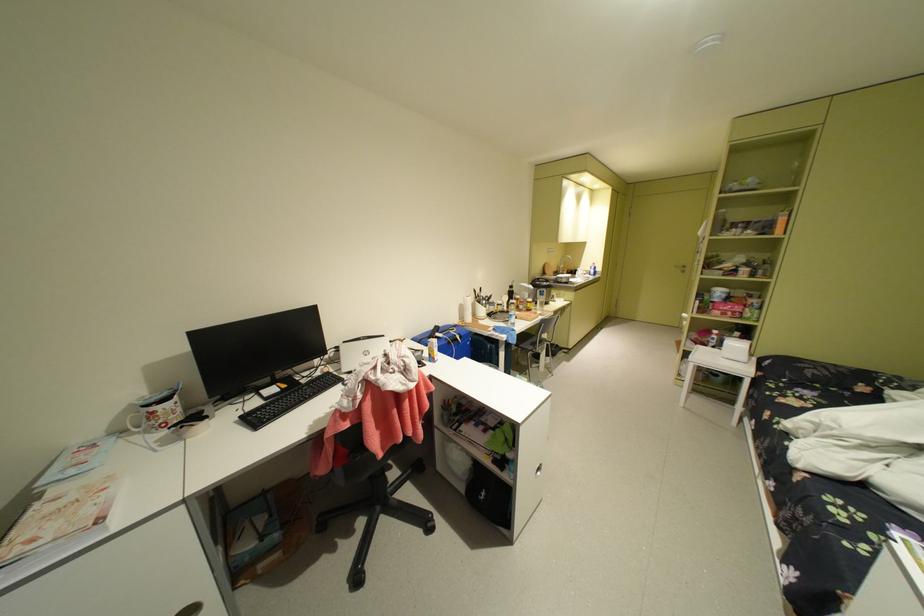
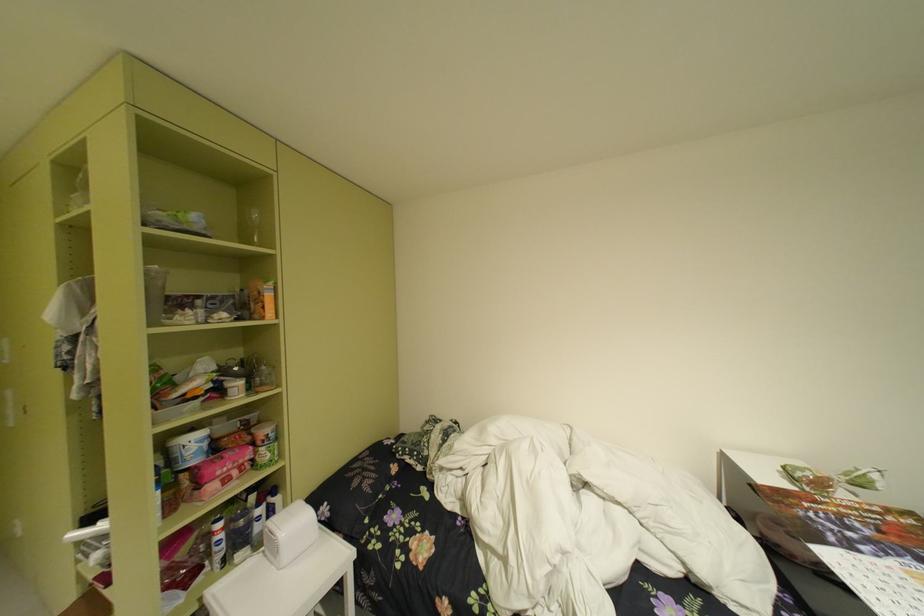
Find the pixel in the second image that matches (x=727, y=334) in the first image.

(235, 528)